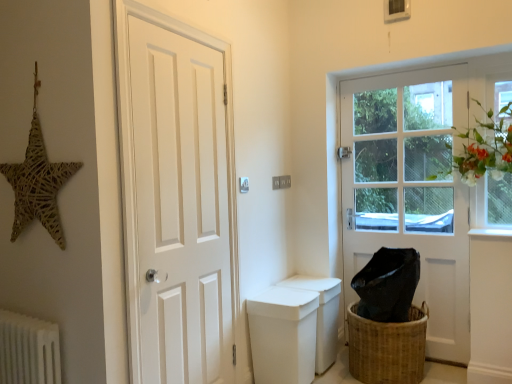
Question: Can you confirm if clear glass window at upper right is thinner than woven straw star at upper left?

Choices:
 (A) no
 (B) yes

Answer: (B)

Question: Does clear glass window at upper right have a larger size compared to woven straw star at upper left?

Choices:
 (A) no
 (B) yes

Answer: (A)

Question: Can you confirm if clear glass window at upper right is positioned to the left of woven straw star at upper left?

Choices:
 (A) yes
 (B) no

Answer: (B)

Question: Does clear glass window at upper right have a lesser height compared to woven straw star at upper left?

Choices:
 (A) no
 (B) yes

Answer: (A)

Question: Is clear glass window at upper right completely or partially outside of woven straw star at upper left?

Choices:
 (A) yes
 (B) no

Answer: (A)

Question: Is clear glass window at upper right oriented towards woven straw star at upper left?

Choices:
 (A) no
 (B) yes

Answer: (A)

Question: Does woven brown basket at lower right have a greater width compared to clear glass window at upper right?

Choices:
 (A) yes
 (B) no

Answer: (A)

Question: Is woven brown basket at lower right not near clear glass window at upper right?

Choices:
 (A) yes
 (B) no

Answer: (B)

Question: Can you confirm if woven brown basket at lower right is thinner than clear glass window at upper right?

Choices:
 (A) yes
 (B) no

Answer: (B)

Question: From the image's perspective, is woven brown basket at lower right on top of clear glass window at upper right?

Choices:
 (A) yes
 (B) no

Answer: (B)

Question: Considering the relative sizes of woven brown basket at lower right and clear glass window at upper right in the image provided, is woven brown basket at lower right taller than clear glass window at upper right?

Choices:
 (A) no
 (B) yes

Answer: (A)

Question: From a real-world perspective, is woven brown basket at lower right located higher than clear glass window at upper right?

Choices:
 (A) yes
 (B) no

Answer: (B)

Question: Would you consider woven brown basket at lower right to be distant from white matte toilet bowl at center?

Choices:
 (A) no
 (B) yes

Answer: (A)